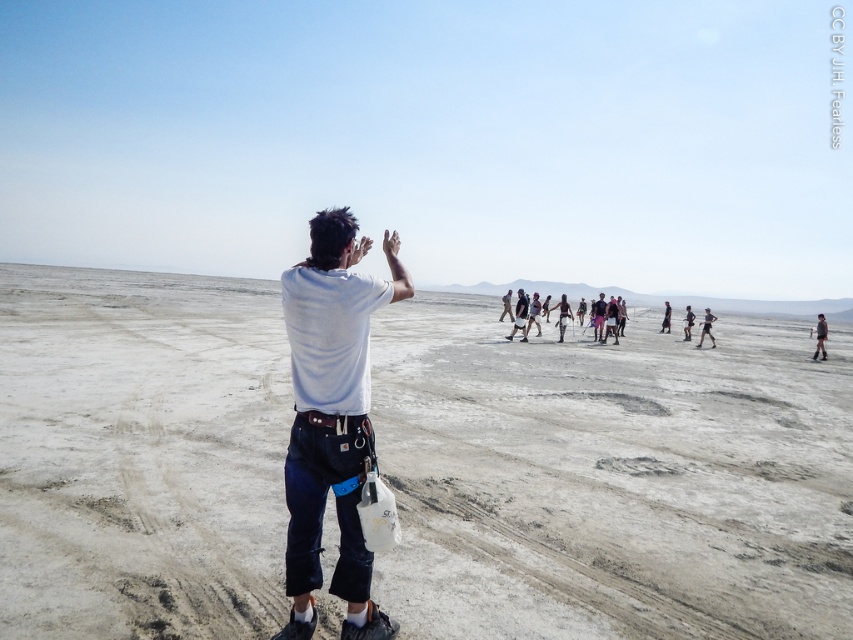
Question: Is dark blue jeans at center wider than dark gray fabric pants at center?

Choices:
 (A) yes
 (B) no

Answer: (B)

Question: Which object is the closest to the light brown fabric pants at center?

Choices:
 (A) dark brown leather jacket at lower right
 (B) black matte person at center
 (C) dark blue jeans at center
 (D) white matte shirt at center

Answer: (B)

Question: Where is white matte shirt at center located in relation to black matte person at center in the image?

Choices:
 (A) above
 (B) below

Answer: (B)

Question: Which point is closer to the camera?

Choices:
 (A) white matte shirt at center
 (B) light brown fabric pants at center
 (C) dark gray fabric pants at center

Answer: (A)

Question: Which of the following is the closest to the observer?

Choices:
 (A) (708, 328)
 (B) (819, 340)

Answer: (B)

Question: Is black matte person at center wider than dark gray fabric pants at center?

Choices:
 (A) no
 (B) yes

Answer: (B)